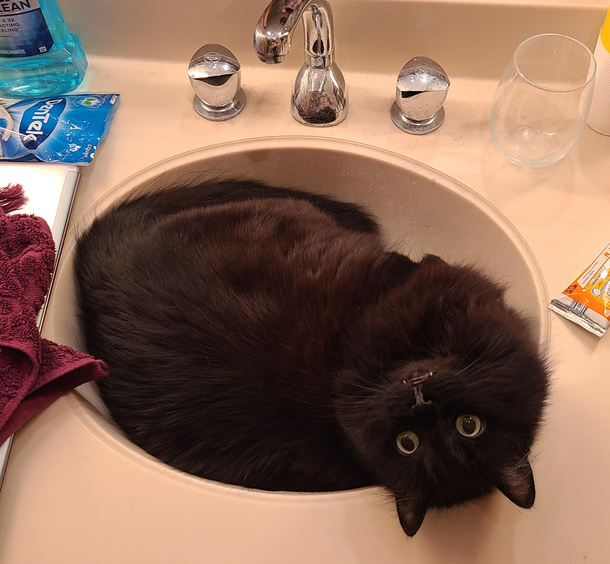
Locate an element on the screen. faucet is located at coordinates (321, 102).